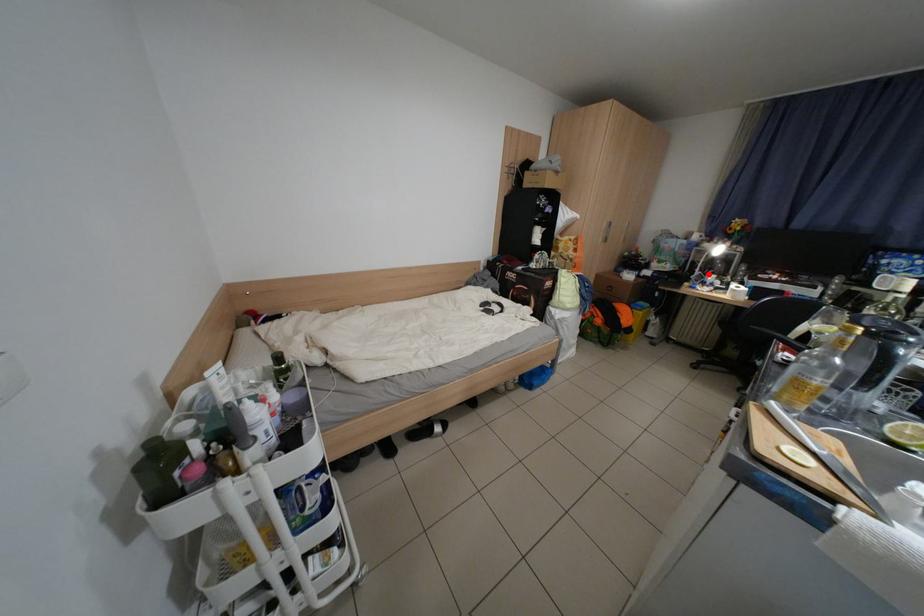
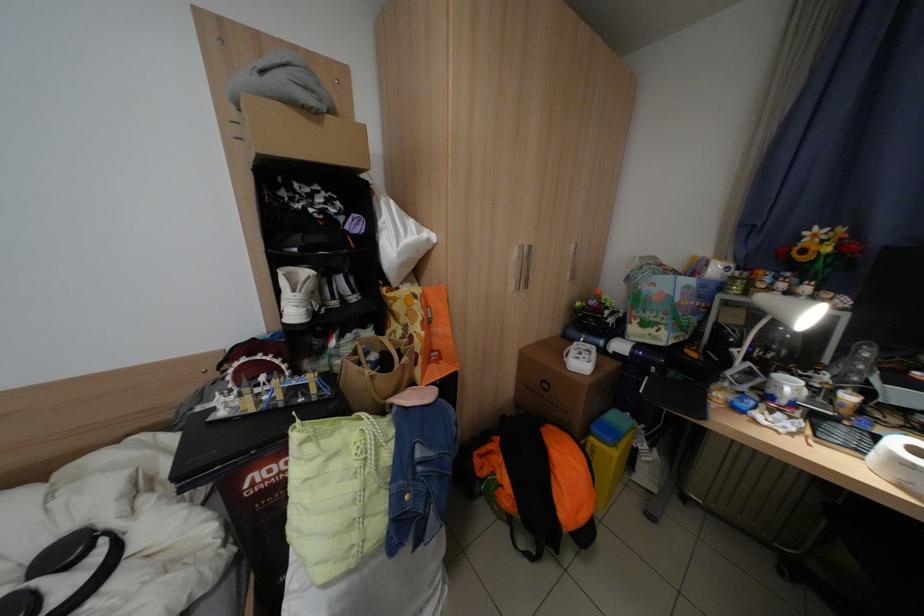
Question: I am providing you with two images of the same scene from different viewpoints. A red point is marked on the first image. Is the red point's position out of view in image 2?

Choices:
 (A) Yes
 (B) No

Answer: (B)